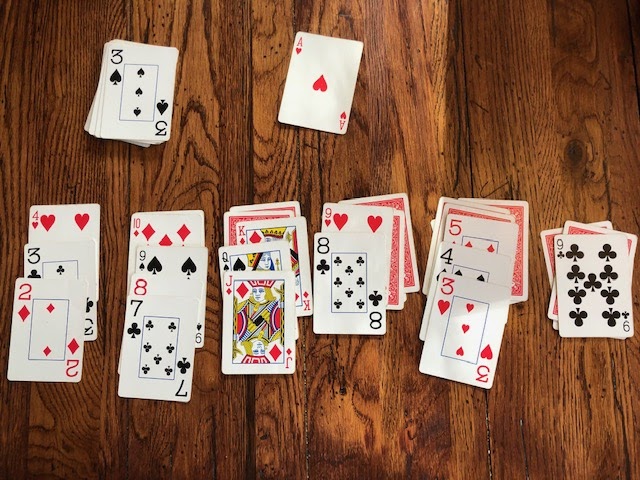
I want to click on lines in table, so click(x=486, y=431), click(x=304, y=423).